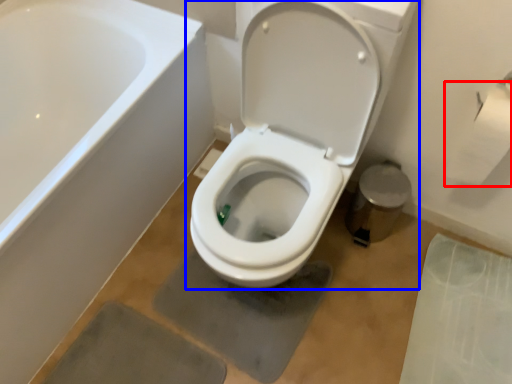
Question: Which of the following is the closest to the observer, toilet paper (highlighted by a red box) or toilet (highlighted by a blue box)?

Choices:
 (A) toilet paper
 (B) toilet

Answer: (B)